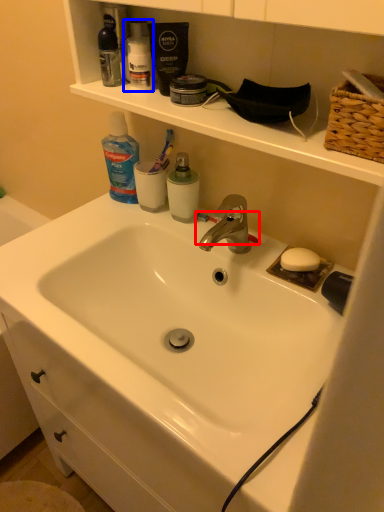
Question: Among these objects, which one is farthest to the camera, toothbrush (highlighted by a red box) or toiletry (highlighted by a blue box)?

Choices:
 (A) toothbrush
 (B) toiletry

Answer: (A)